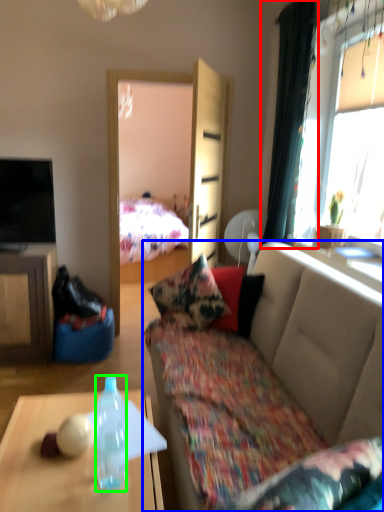
Question: Which object is positioned closest to curtain (highlighted by a red box)? Select from studio couch (highlighted by a blue box) and bottle (highlighted by a green box).

Choices:
 (A) studio couch
 (B) bottle

Answer: (A)